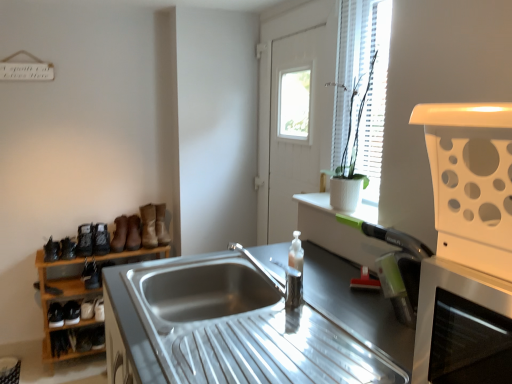
Question: Should I look upward or downward to see translucent plastic soap dispenser at center?

Choices:
 (A) down
 (B) up

Answer: (A)

Question: From the image's perspective, would you say translucent plastic soap dispenser at center is shown under leather boot at left, marked as the second boot in a right-to-left arrangement?

Choices:
 (A) yes
 (B) no

Answer: (A)

Question: Considering the relative positions of translucent plastic soap dispenser at center and leather boot at left, marked as the second boot in a right-to-left arrangement, in the image provided, is translucent plastic soap dispenser at center to the left of leather boot at left, marked as the second boot in a right-to-left arrangement, from the viewer's perspective?

Choices:
 (A) yes
 (B) no

Answer: (B)

Question: Is translucent plastic soap dispenser at center closer to camera compared to leather boot at left, marked as the 6th boot in a left-to-right arrangement?

Choices:
 (A) no
 (B) yes

Answer: (B)

Question: Is the depth of translucent plastic soap dispenser at center greater than that of leather boot at left, marked as the 6th boot in a left-to-right arrangement?

Choices:
 (A) no
 (B) yes

Answer: (A)

Question: Considering the relative sizes of translucent plastic soap dispenser at center and leather boot at left, marked as the second boot in a right-to-left arrangement, in the image provided, is translucent plastic soap dispenser at center bigger than leather boot at left, marked as the second boot in a right-to-left arrangement,?

Choices:
 (A) yes
 (B) no

Answer: (B)

Question: Does translucent plastic soap dispenser at center have a greater width compared to leather boot at left, marked as the second boot in a right-to-left arrangement?

Choices:
 (A) no
 (B) yes

Answer: (A)

Question: Could you tell me if leather boot at left, the first boot positioned from the left, is facing white plastic vent at right?

Choices:
 (A) yes
 (B) no

Answer: (B)

Question: Is leather boot at left, the first boot positioned from the left, at the left side of white plastic vent at right?

Choices:
 (A) no
 (B) yes

Answer: (B)

Question: Is leather boot at left, the first boot positioned from the left, taller than white plastic vent at right?

Choices:
 (A) no
 (B) yes

Answer: (A)

Question: Can you confirm if leather boot at left, the 7th boot when ordered from right to left, is wider than white plastic vent at right?

Choices:
 (A) yes
 (B) no

Answer: (B)

Question: Is leather boot at left, the 7th boot when ordered from right to left, positioned behind white plastic vent at right?

Choices:
 (A) yes
 (B) no

Answer: (A)

Question: Is leather boot at left, the first boot positioned from the left, closer to the viewer compared to white plastic vent at right?

Choices:
 (A) no
 (B) yes

Answer: (A)

Question: Is black leather shoe at lower left, which is the 4th shoe from top to bottom, wider than matte black shoe at left, the first shoe viewed from the top?

Choices:
 (A) yes
 (B) no

Answer: (A)